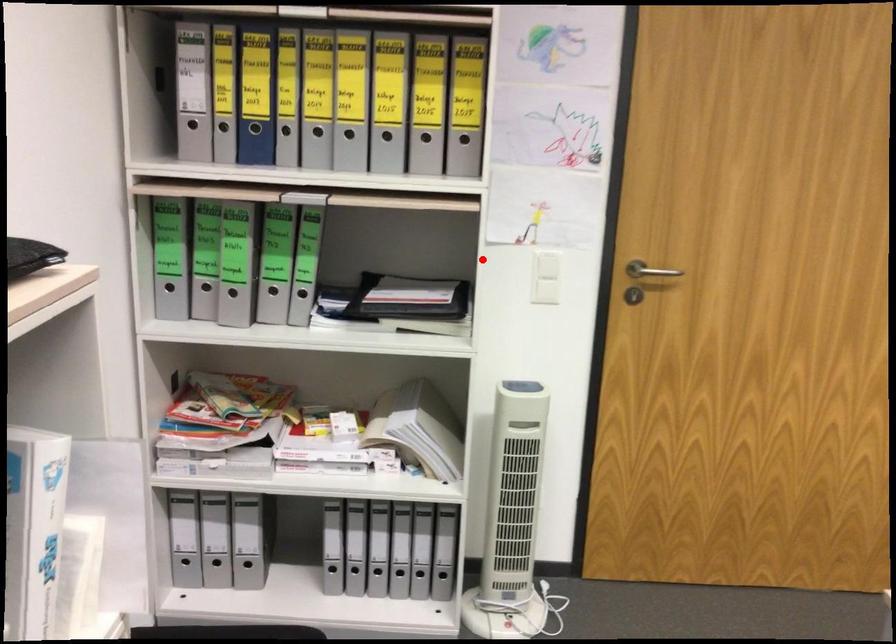
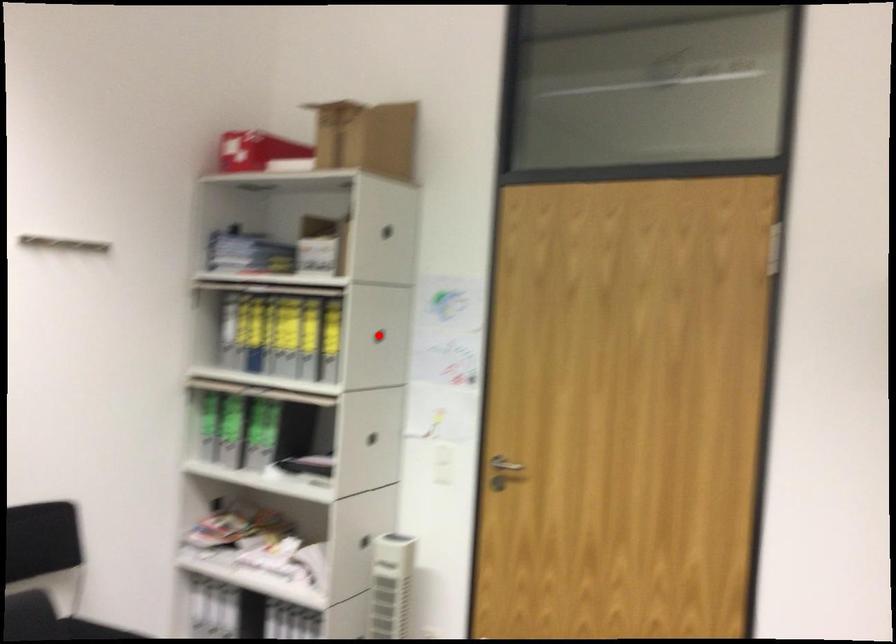
I am providing you with two images of the same scene from different viewpoints. A red point is marked on the first image and another point is marked on the second image. Does the point marked in image1 correspond to the same location as the one in image2?

No